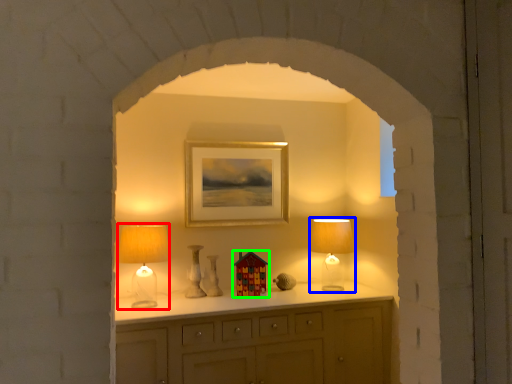
Question: Estimate the real-world distances between objects in this image. Which object is farther from table lamp (highlighted by a red box), table lamp (highlighted by a blue box) or toy (highlighted by a green box)?

Choices:
 (A) table lamp
 (B) toy

Answer: (A)